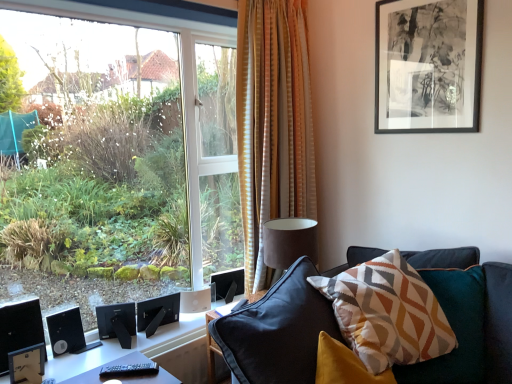
Question: From a real-world perspective, relative to transparent glass window at left, is black matte speaker at lower left, acting as the second speaker starting from the left, vertically above or below?

Choices:
 (A) below
 (B) above

Answer: (A)

Question: Considering the positions of black matte speaker at lower left, acting as the second speaker starting from the left, and transparent glass window at left in the image, is black matte speaker at lower left, acting as the second speaker starting from the left, bigger or smaller than transparent glass window at left?

Choices:
 (A) big
 (B) small

Answer: (B)

Question: Considering the real-world distances, which object is closest to the black matte speaker at lower left, the second speaker viewed from the right?

Choices:
 (A) transparent glass window at left
 (B) black plastic table at lower left
 (C) black matte speaker at lower left, which is the 1th speaker in left-to-right order
 (D) black matte speaker at lower left, which is the 3th speaker from left to right
 (E) geometric-patterned fabric pillow at center-right

Answer: (D)

Question: Which is farther from the black glossy monitor at lower left?

Choices:
 (A) transparent glass window at left
 (B) black matte speaker at lower left, which is the 3th speaker from left to right
 (C) black plastic table at lower left
 (D) black matte picture frame at upper right
 (E) black matte speaker at lower left, acting as the second speaker starting from the left

Answer: (A)